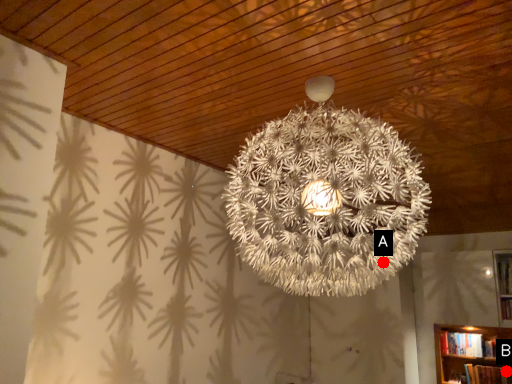
Question: Two points are circled on the image, labeled by A and B beside each circle. Which point is closer to the camera taking this photo?

Choices:
 (A) A is closer
 (B) B is closer

Answer: (A)